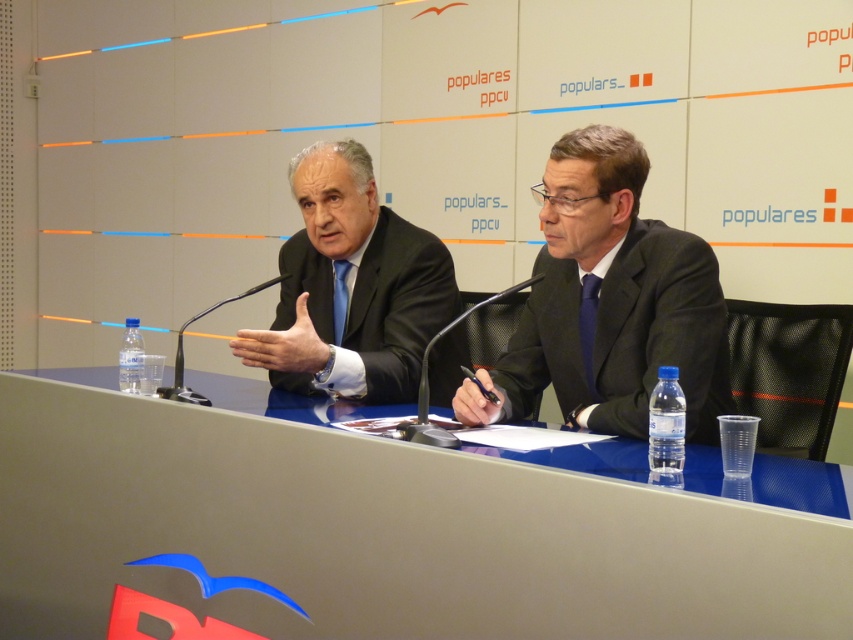
In the scene shown: You are attending a formal event with a blue glossy table at center. If you need to place a name tag exactly at the center of the table, where should you place it?

The blue glossy table at center is already located at point (x=389, y=525), so you should place the name tag at the center coordinates of the table, which would be approximately at point (x=389, y=525).

What object is located at the coordinates point (389, 525)?

The blue glossy table at center is located at point (389, 525).

Based on the coordinates provided, what object is located at point (389, 525) in the scene?

The blue glossy table at center is located at point (389, 525).